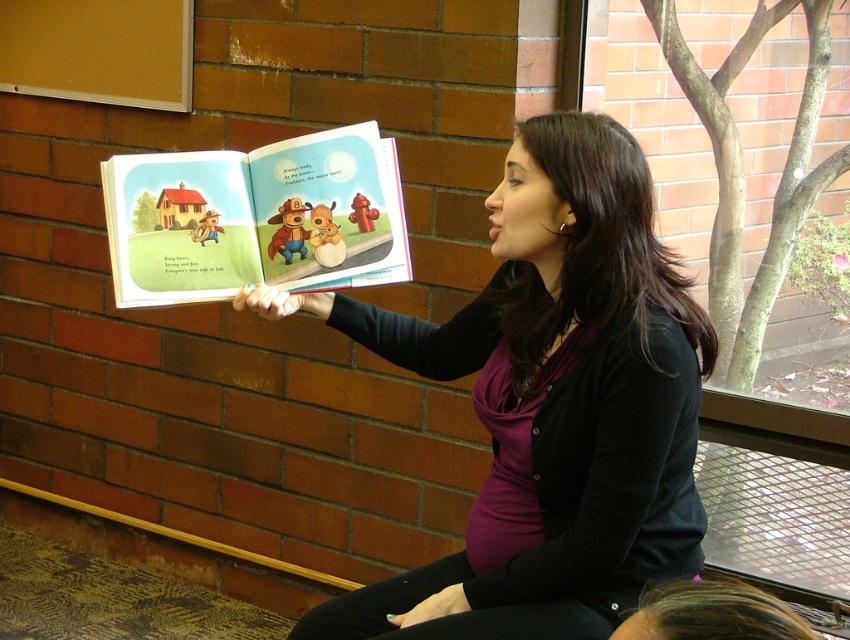
You are a photographer taking a picture of the scene. You notice two points in the image, one at point (579, 296) and another at point (292, 244). Which point will appear larger in your photo?

Point (579, 296) is closer to the camera than point (292, 244), so it will appear larger in the photo.

You are a tailor who needs to determine which item takes up more horizontal space between the matte black sweater at center and the matte paper book at center. Based on the scene, which one has a greater width?

The matte black sweater at center has a greater width than the matte paper book at center.

You are standing in front of the brick wall where the woman is seated, holding a 1.5 meter long pole. You want to place the pole horizontally between the camera and the point at coordinates point [530,358]. Will the pole reach that point?

The point at coordinates point [530,358] is 1.83 meters away from the camera. Since the pole is only 1.5 meters long, it will not be long enough to reach the point.